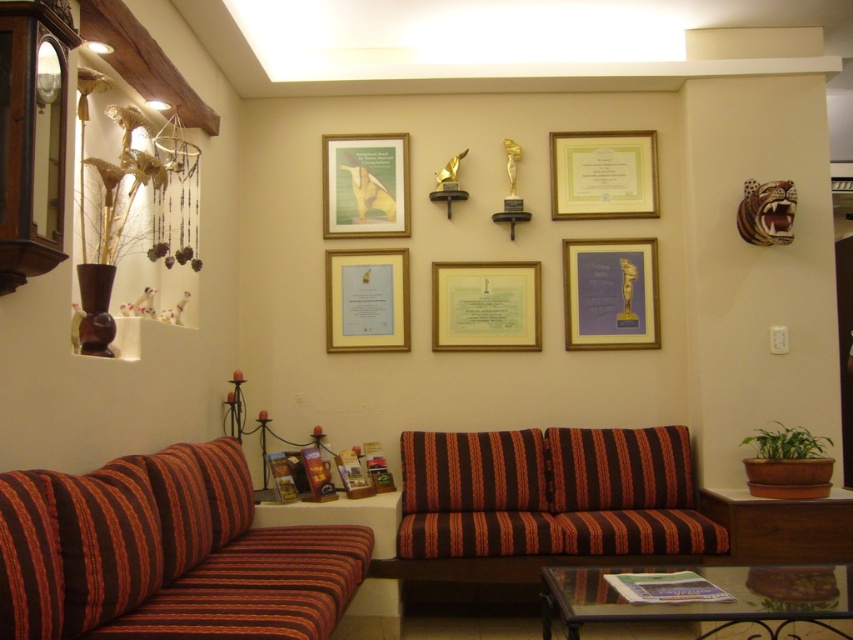
Does gold-framed picture at center appear over green paper certificate at center?

Yes, gold-framed picture at center is above green paper certificate at center.

Which is behind, point (614, 256) or point (491, 336)?

The point (614, 256) is behind.

Locate an element on the screen. Image resolution: width=853 pixels, height=640 pixels. gold-framed picture at center is located at coordinates (610, 292).

Does striped fabric couch at lower left have a lesser width compared to matte green paper at center?

No, striped fabric couch at lower left is not thinner than matte green paper at center.

Can you confirm if striped fabric couch at lower left is positioned below matte green paper at center?

Incorrect, striped fabric couch at lower left is not positioned below matte green paper at center.

You are a GUI agent. You are given a task and a screenshot of the screen. Output one action in this format:
    pyautogui.click(x=<x>, y=<y>)
    Task: Click on the striped fabric couch at lower left
    The image size is (853, 640).
    Given the screenshot: What is the action you would take?
    pyautogui.click(x=165, y=554)

Which is behind, point (426, 488) or point (399, 248)?

The point (399, 248) is behind.

Between brown striped couch at center and gold/metallic picture frame at center, which one has more height?

With more height is brown striped couch at center.

What do you see at coordinates (550, 493) in the screenshot?
I see `brown striped couch at center` at bounding box center [550, 493].

The height and width of the screenshot is (640, 853). Identify the location of brown striped couch at center. (550, 493).